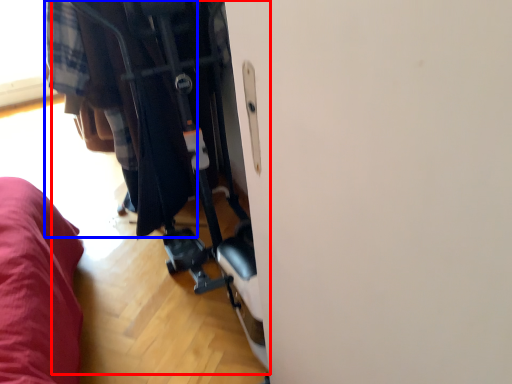
Question: Which object is closer to the camera taking this photo, baby carriage (highlighted by a red box) or clothing (highlighted by a blue box)?

Choices:
 (A) baby carriage
 (B) clothing

Answer: (A)